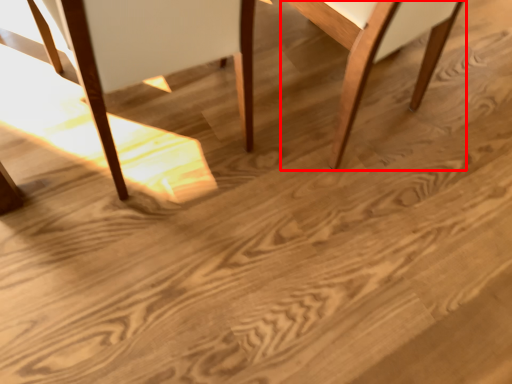
Question: From the image's perspective, where is chair (annotated by the red box) located in relation to chair in the image?

Choices:
 (A) above
 (B) below

Answer: (A)